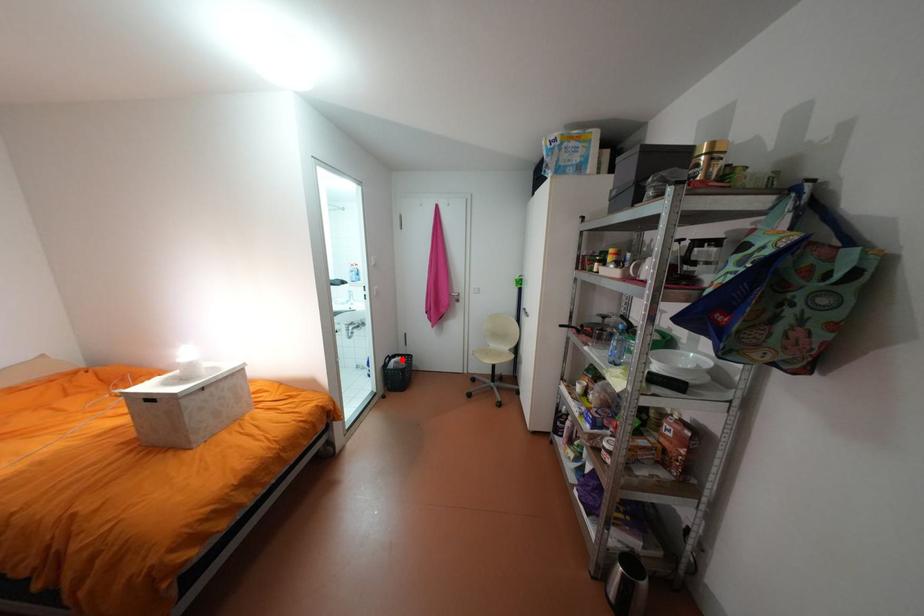
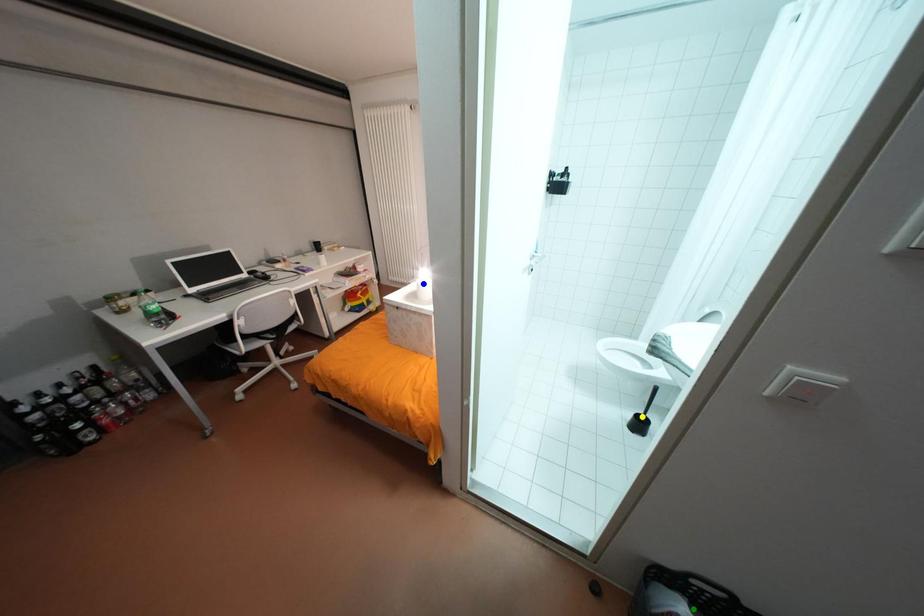
Question: I am providing you with two images of the same scene from different viewpoints. A red point is marked on the first image. You are given multiple points on the second image. Which mark in image 2 goes with the point in image 1?

Choices:
 (A) green point
 (B) yellow point
 (C) blue point

Answer: (A)